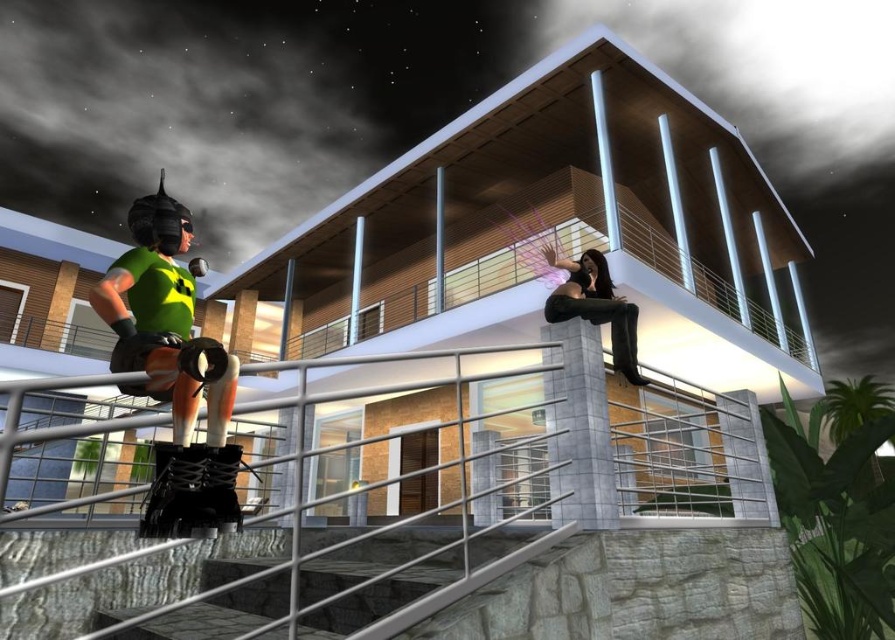
You are an observer standing in the middle of the scene. You notice the matte green jersey at left and the stone textured stairs at lower center. Which object appears larger in the image?

The matte green jersey at left appears larger than the stone textured stairs at lower center.

You are a character in the scene and need to reach the metallic silver rail at lower center. Which direction should you move relative to the matte black pants at upper center?

You should move downward from the matte black pants at upper center to reach the metallic silver rail at lower center since the rail is located below the pants.